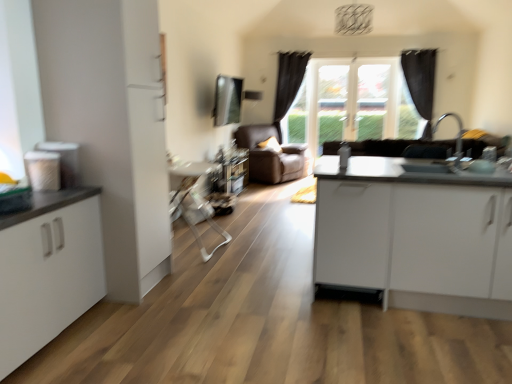
Question: Considering the positions of white matte cabinet at left and white glossy cabinet at right, the first table when ordered from right to left, in the image, is white matte cabinet at left wider or thinner than white glossy cabinet at right, the first table when ordered from right to left,?

Choices:
 (A) wide
 (B) thin

Answer: (B)

Question: From the image's perspective, is white matte cabinet at left located above or below white glossy cabinet at right, acting as the second table starting from the left?

Choices:
 (A) below
 (B) above

Answer: (A)

Question: Considering the real-world distances, which object is farthest from the white matte cabinet at left?

Choices:
 (A) black fabric curtain at upper right, which appears as the 2th curtain when viewed from the left
 (B) metallic silver table at center, which is counted as the 1th table, starting from the left
 (C) transparent glass window at center
 (D) black fabric curtain at center, the second curtain when ordered from right to left
 (E) white glossy sink at right

Answer: (A)

Question: Estimate the real-world distances between objects in this image. Which object is closer to the white glossy sink at right?

Choices:
 (A) black fabric curtain at center, the second curtain when ordered from right to left
 (B) transparent glass window at center
 (C) metallic silver table at center, which is counted as the 1th table, starting from the left
 (D) black fabric curtain at upper right, which appears as the 1th curtain when viewed from the right
 (E) white matte cabinet at left

Answer: (E)